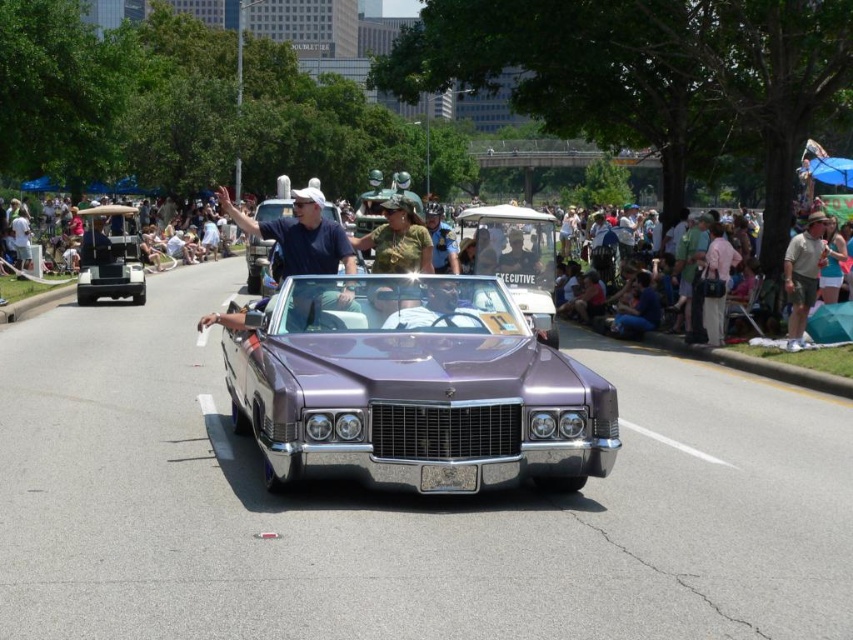
You are a photographer at the parade. You have a camera with a 30cm focal length lens. The metallic purple car at center and the purple metallic car at center are both in your frame. Which car should you focus on to capture the one that is closer to you?

The metallic purple car at center is shorter than the purple metallic car at center. Since shorter objects appear closer in photographs, you should focus on the metallic purple car at center to capture the one that is closer to you.

You are a photographer at the parade. You want to capture both the metallic blue shirt at center and the khaki cotton shirt at right in a single photo. Which shirt should you focus on to ensure both are in frame without zooming in or out?

You should focus on the metallic blue shirt at center because it is larger in size compared to the khaki cotton shirt at right, allowing both to fit within the frame without needing to adjust the zoom.